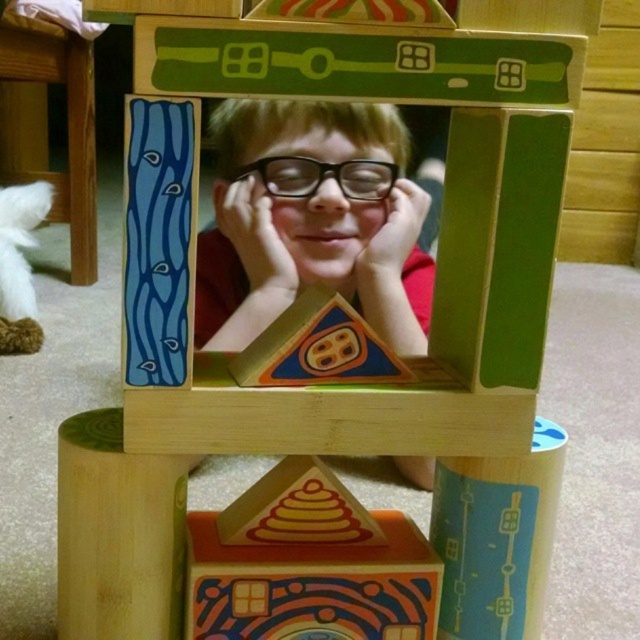
Is point (349, 140) farther from viewer compared to point (84, 70)?

No, (349, 140) is in front of (84, 70).

Find the location of a particular element. This screenshot has height=640, width=640. matte black glasses at center is located at coordinates tap(310, 220).

At what (x,y) coordinates should I click in order to perform the action: click on matte black glasses at center. Please return your answer as a coordinate pair (x, y). Looking at the image, I should click on (310, 220).